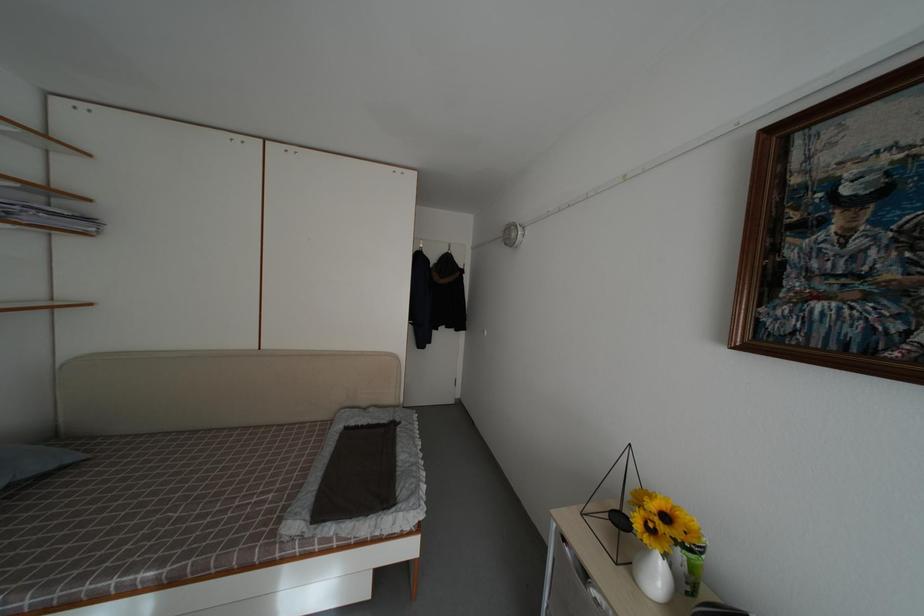
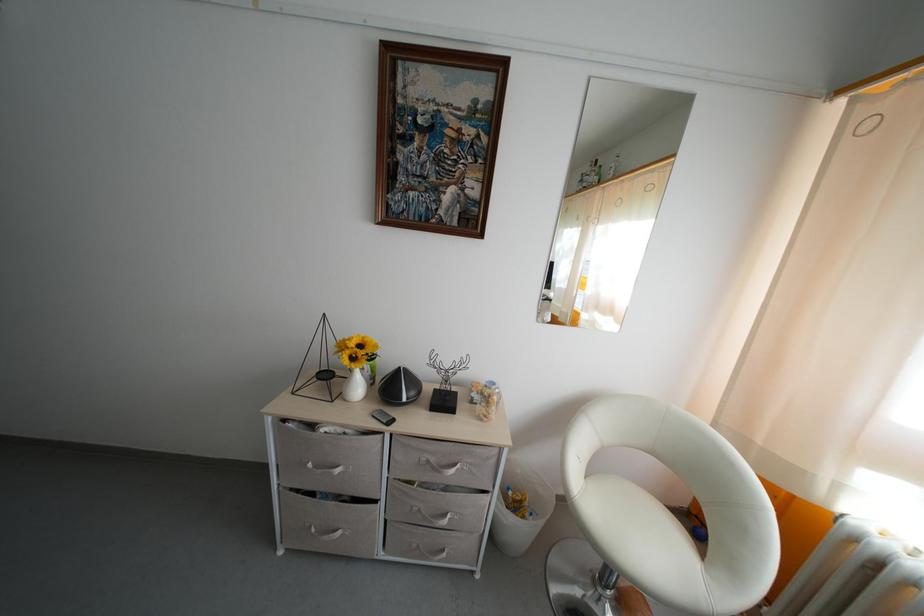
Locate, in the second image, the point that corresponds to pixel 652 546 in the first image.

(359, 371)